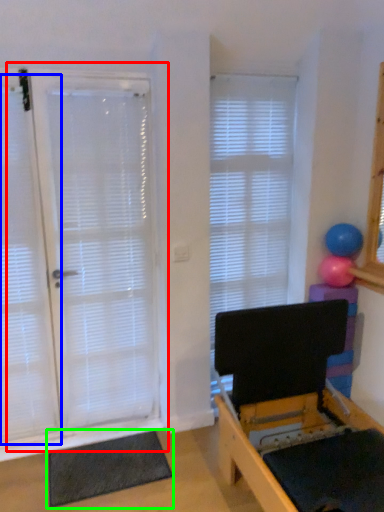
Question: Which is farther away from door (highlighted by a red box)? curtain (highlighted by a blue box) or yoga mat (highlighted by a green box)?

Choices:
 (A) curtain
 (B) yoga mat

Answer: (B)